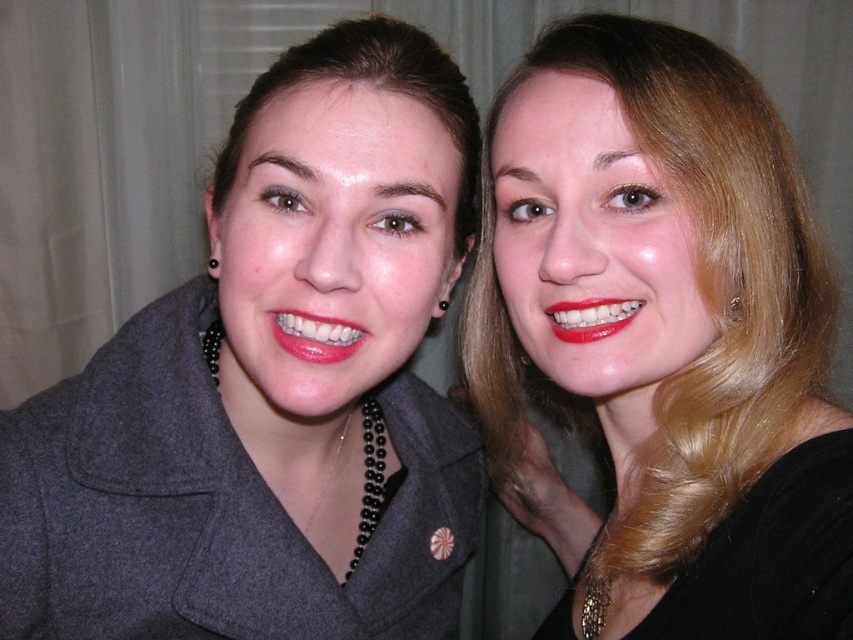
Can you confirm if blonde hair at upper right is positioned to the right of matte red lipstick at right?

Correct, you'll find blonde hair at upper right to the right of matte red lipstick at right.

Does blonde hair at upper right appear on the left side of matte red lipstick at right?

Incorrect, blonde hair at upper right is not on the left side of matte red lipstick at right.

Is point (704, 371) more distant than point (621, 314)?

Yes, point (704, 371) is behind point (621, 314).

You are a GUI agent. You are given a task and a screenshot of the screen. Output one action in this format:
    pyautogui.click(x=<x>, y=<y>)
    Task: Click on the blonde hair at upper right
    
    Given the screenshot: What is the action you would take?
    pyautogui.click(x=666, y=336)

Which is in front, point (138, 472) or point (585, 310)?

Positioned in front is point (585, 310).

Does point (10, 456) come behind point (584, 308)?

Yes, point (10, 456) is behind point (584, 308).

The height and width of the screenshot is (640, 853). I want to click on matte gray coat at left, so click(271, 387).

Who is shorter, blonde hair at upper right or glossy matte lipstick at center?

glossy matte lipstick at center

Looking at this image, is blonde hair at upper right to the left of glossy matte lipstick at center from the viewer's perspective?

No, blonde hair at upper right is not to the left of glossy matte lipstick at center.

Which is behind, point (497, 218) or point (349, 349)?

Positioned behind is point (497, 218).

What are the coordinates of `blonde hair at upper right` in the screenshot? It's located at (666, 336).